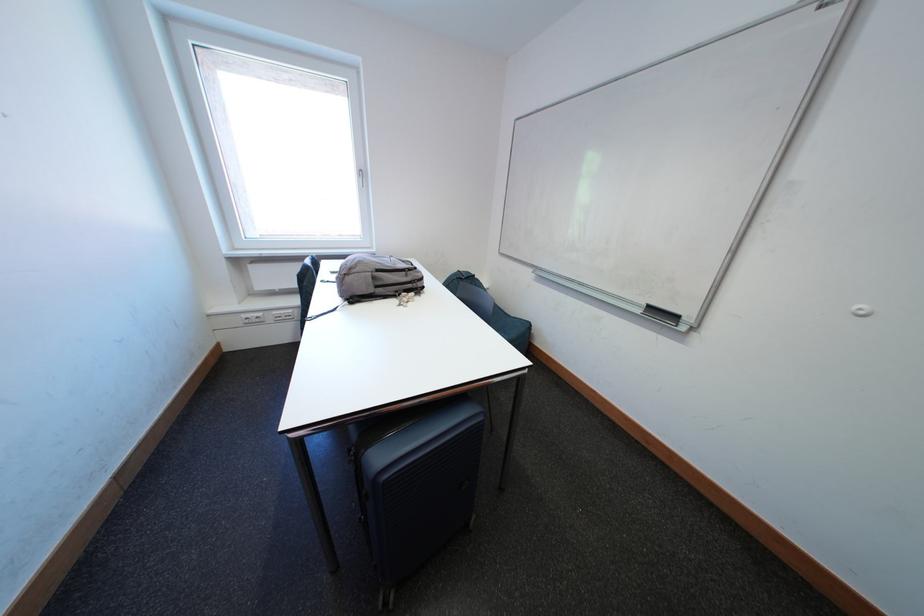
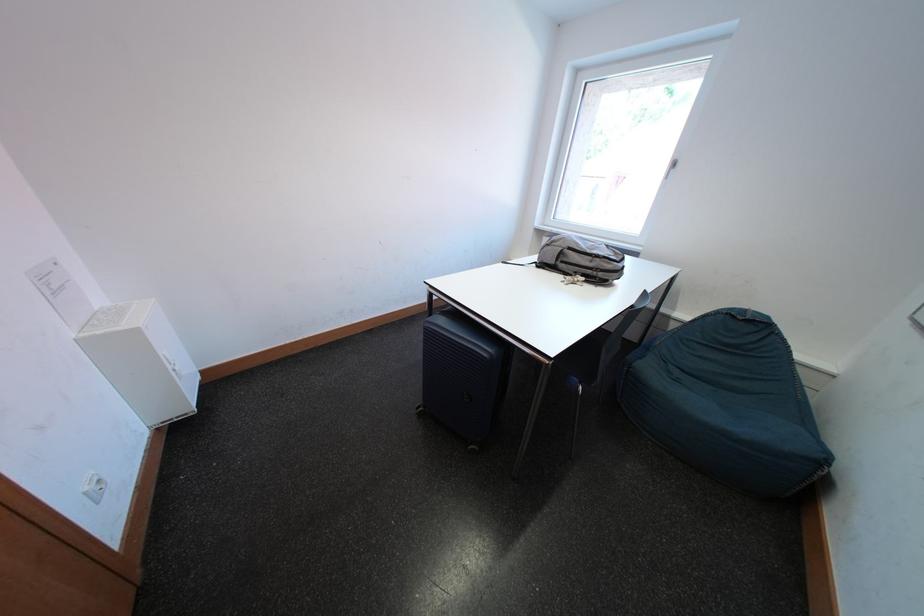
Based on the continuous images, in which direction is the camera rotating?

The rotation direction of the camera is left-down.